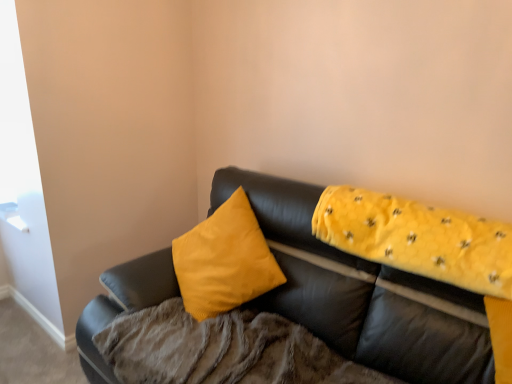
Question: Is yellow quilted fabric at upper right taller or shorter than matte black couch at center?

Choices:
 (A) tall
 (B) short

Answer: (B)

Question: Looking at the image, does yellow quilted fabric at upper right seem bigger or smaller compared to matte black couch at center?

Choices:
 (A) small
 (B) big

Answer: (A)

Question: Which is nearer to the soft yellow blanket at upper right?

Choices:
 (A) yellow quilted fabric at upper right
 (B) matte black couch at center

Answer: (B)

Question: Estimate the real-world distances between objects in this image. Which object is closer to the soft yellow blanket at upper right?

Choices:
 (A) yellow quilted fabric at upper right
 (B) matte black couch at center

Answer: (B)